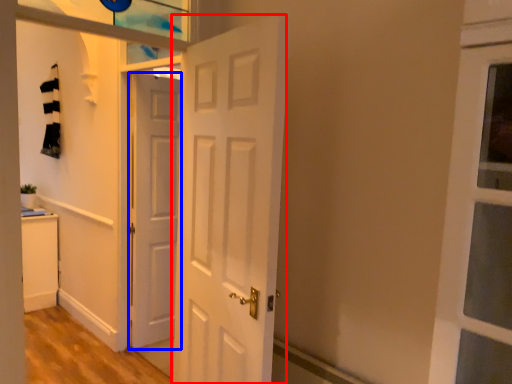
Question: Which point is further to the camera, door (highlighted by a red box) or door (highlighted by a blue box)?

Choices:
 (A) door
 (B) door

Answer: (B)